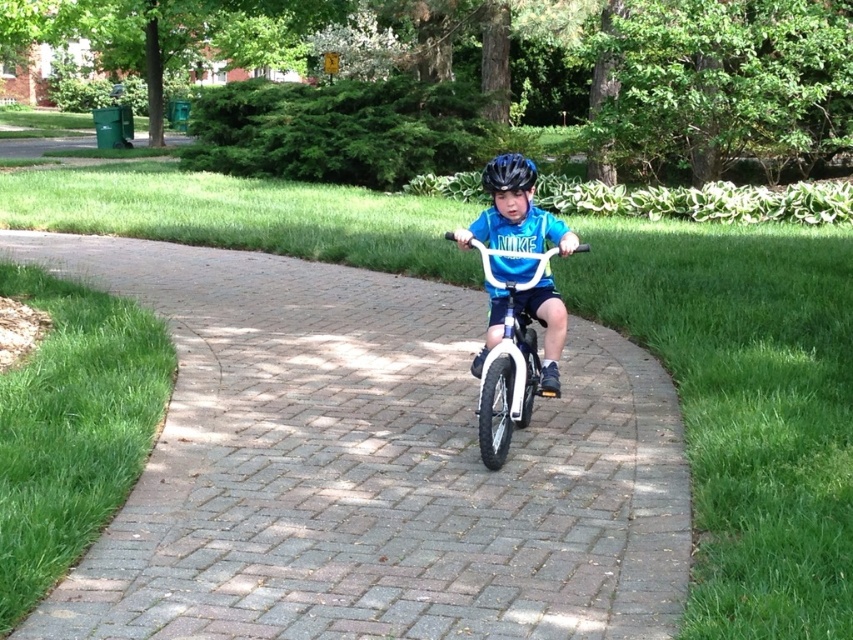
Question: Considering the real-world distances, which object is closest to the gray brick pavement at center?

Choices:
 (A) blue matte bicycle helmet at center
 (B) blue matte helmet at center

Answer: (B)

Question: From the image, what is the correct spatial relationship of gray brick pavement at center in relation to blue matte helmet at center?

Choices:
 (A) right
 (B) left

Answer: (B)

Question: Can you confirm if white matte bicycle at center is smaller than blue matte bicycle helmet at center?

Choices:
 (A) no
 (B) yes

Answer: (B)

Question: Does gray brick pavement at center appear on the left side of blue matte helmet at center?

Choices:
 (A) no
 (B) yes

Answer: (B)

Question: Which point is farther to the camera?

Choices:
 (A) blue matte helmet at center
 (B) gray brick pavement at center
 (C) white matte bicycle at center

Answer: (A)

Question: Which of the following is the farthest from the observer?

Choices:
 (A) gray brick pavement at center
 (B) white matte bicycle at center

Answer: (B)